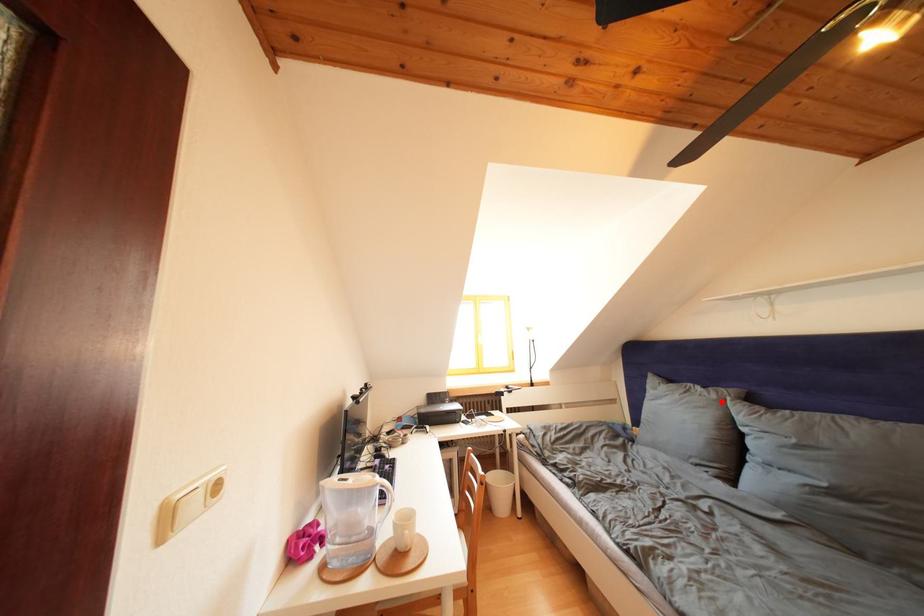
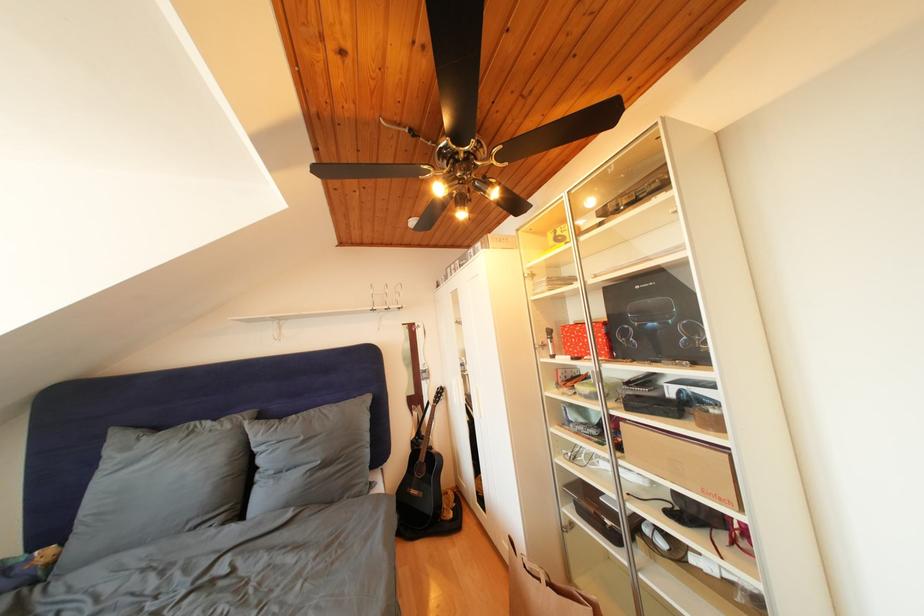
Find the pixel in the second image that matches the highlighted location in the first image.

(236, 432)